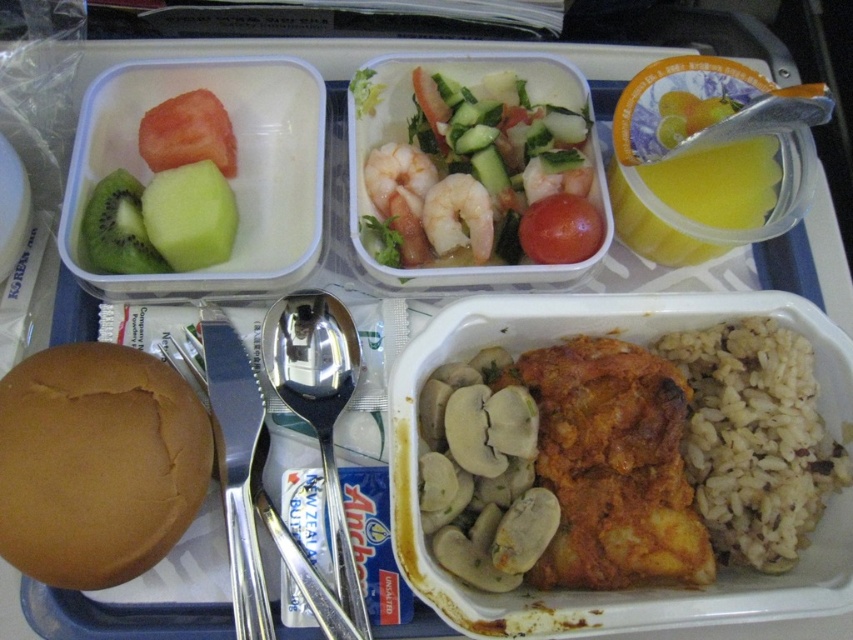
In the scene shown: You are a food critic evaluating the presentation of this airline meal. Based on the image, which object between the shiny orange shrimp at center and the brown matte bun at lower left appears taller?

The shiny orange shrimp at center appears taller than the brown matte bun at lower left according to the description provided.

You are a food inspector checking the meal tray. You need to determine if the brown matte bun at lower left can fit into the compartment currently holding the green matte kiwi at upper left. Based on their widths, what is your conclusion?

The brown matte bun at lower left is wider than the green matte kiwi at upper left. Therefore, the brown matte bun at lower left may not fit into the compartment that currently holds the green matte kiwi at upper left due to its greater width.